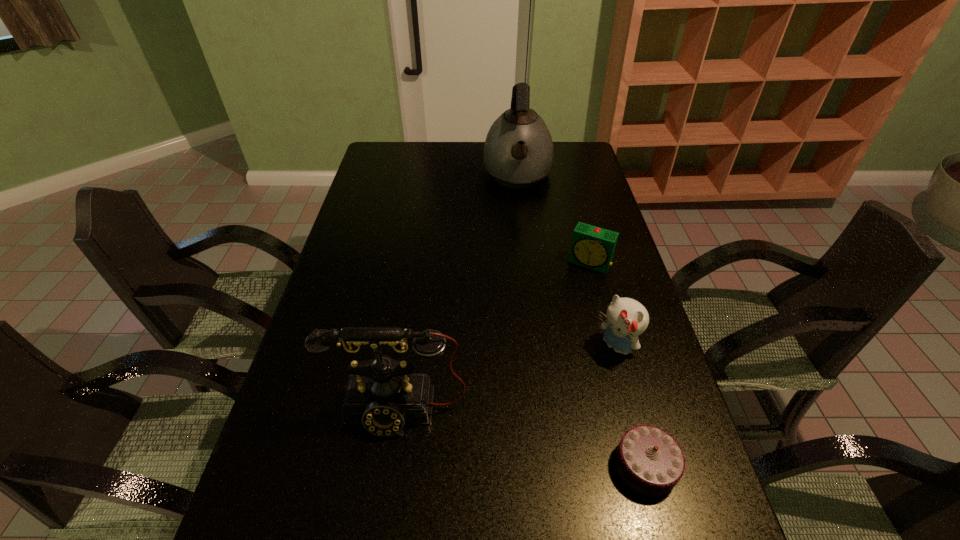
The width and height of the screenshot is (960, 540). I want to click on the second tallest object, so click(382, 394).

Image resolution: width=960 pixels, height=540 pixels. Identify the location of the leftmost object. (382, 394).

Find the location of a particular element. Image resolution: width=960 pixels, height=540 pixels. the shortest object is located at coordinates (649, 460).

At what (x,y) coordinates should I click in order to perform the action: click on the third nearest object. Please return your answer as a coordinate pair (x, y). Looking at the image, I should click on (626, 319).

This screenshot has width=960, height=540. What are the coordinates of `kitten` in the screenshot? It's located at (626, 319).

Where is `alarm clock`? The image size is (960, 540). alarm clock is located at coordinates (592, 247).

This screenshot has height=540, width=960. What are the coordinates of `the fourth tallest object` in the screenshot? It's located at (592, 247).

Find the location of a particular element. This screenshot has width=960, height=540. the farthest object is located at coordinates (518, 151).

Identify the location of the tallest object. (518, 151).

Where is `vacant space located 0.150m on the dial of the leftmost object`? The height and width of the screenshot is (540, 960). vacant space located 0.150m on the dial of the leftmost object is located at coordinates (384, 513).